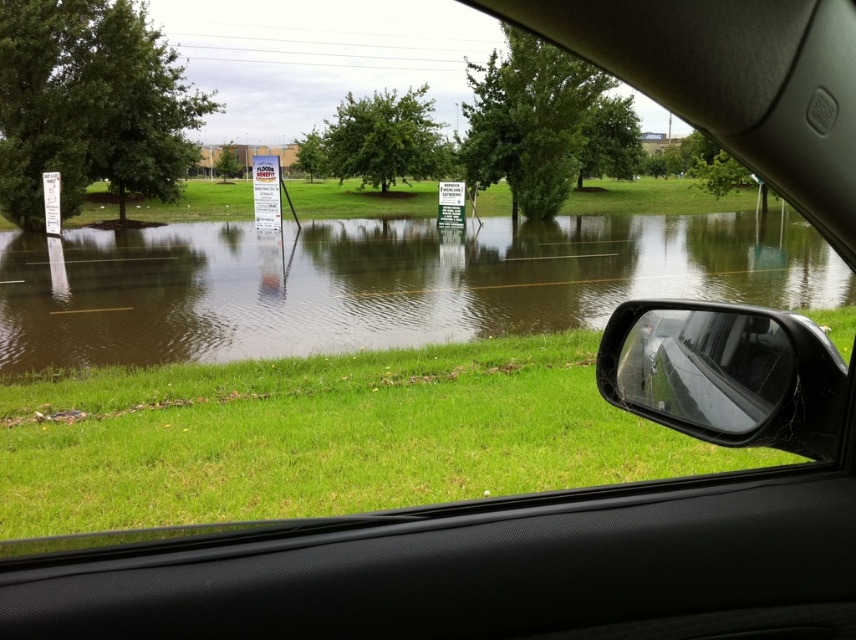
Question: Which point is closer to the camera?

Choices:
 (A) brown murky water at lower left
 (B) transparent glass side mirror at lower right

Answer: (B)

Question: Can you confirm if brown murky water at lower left is thinner than transparent glass side mirror at lower right?

Choices:
 (A) no
 (B) yes

Answer: (A)

Question: Is brown murky water at lower left wider than transparent glass side mirror at lower right?

Choices:
 (A) yes
 (B) no

Answer: (A)

Question: Can you confirm if brown murky water at lower left is smaller than transparent glass side mirror at lower right?

Choices:
 (A) no
 (B) yes

Answer: (A)

Question: Which point is closer to the camera?

Choices:
 (A) (698, 305)
 (B) (843, 300)

Answer: (A)